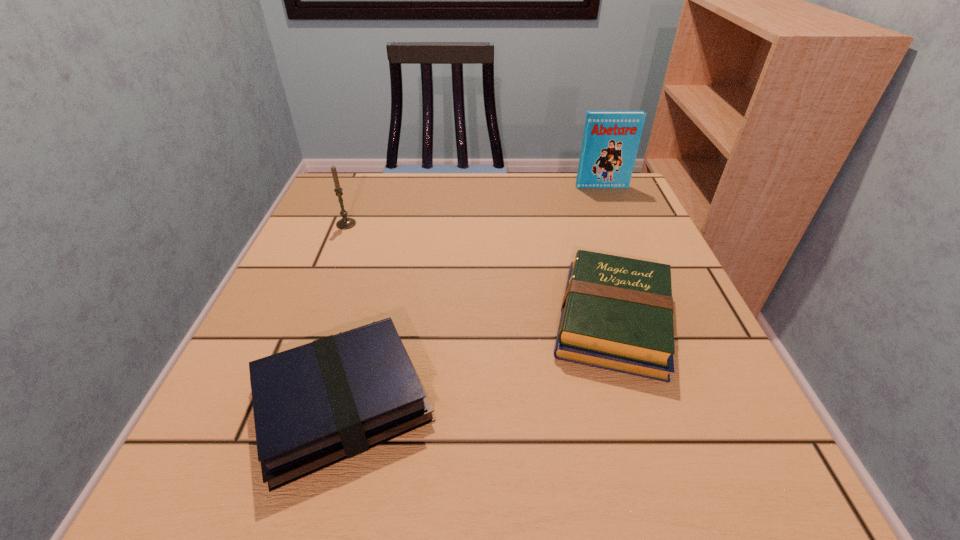
Find the location of a particular element. The width and height of the screenshot is (960, 540). the farthest object is located at coordinates (611, 139).

Find the location of a particular element. the farthest book is located at coordinates (611, 139).

This screenshot has height=540, width=960. Find the location of `candle`. candle is located at coordinates (345, 223).

The height and width of the screenshot is (540, 960). Identify the location of the third nearest object. (345, 223).

The image size is (960, 540). In order to click on the leftmost book in this screenshot , I will do `click(317, 404)`.

This screenshot has width=960, height=540. Identify the location of vacant space located on the front cover of the farthest book. click(619, 230).

At what (x,y) coordinates should I click in order to perform the action: click on free space located on the front of the second tallest object. Please return your answer as a coordinate pair (x, y). Looking at the image, I should click on (317, 298).

This screenshot has height=540, width=960. Find the location of `free space located 0.270m on the back of the leftmost book`. free space located 0.270m on the back of the leftmost book is located at coordinates (386, 241).

Where is `book that is at the far edge`? book that is at the far edge is located at coordinates [x=611, y=139].

Find the location of `candle that is at the far edge`. candle that is at the far edge is located at coordinates (345, 223).